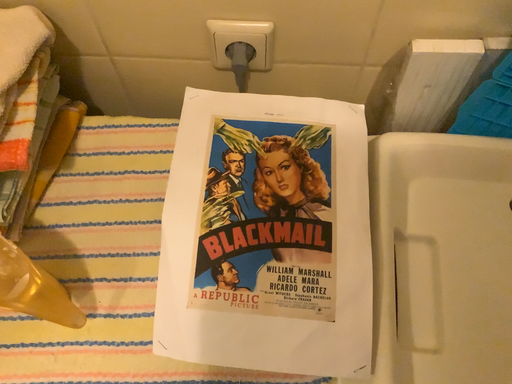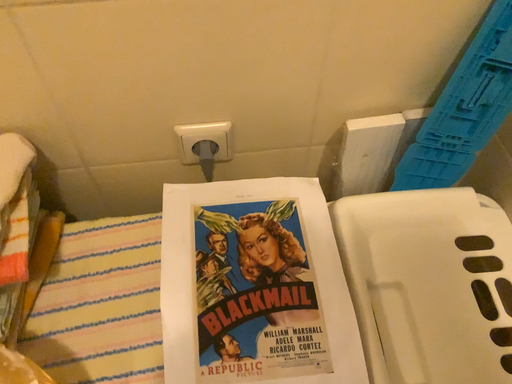
Question: Which way did the camera rotate in the video?

Choices:
 (A) rotated downward
 (B) rotated upward

Answer: (B)